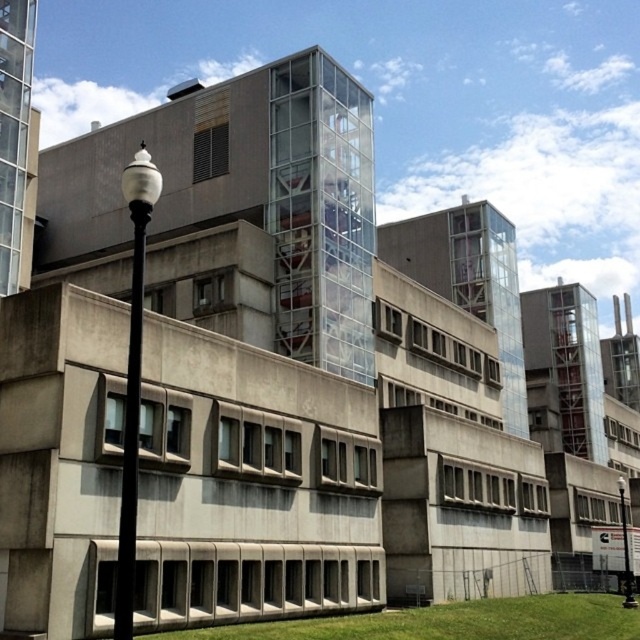
Question: Which point is farther to the camera?

Choices:
 (A) black metal/texture lamp post at left
 (B) black glass lamp post at lower right
 (C) green grass at lower center

Answer: (B)

Question: Which is nearer to the black glass lamp post at lower right?

Choices:
 (A) green grass at lower center
 (B) black metal/texture lamp post at left

Answer: (A)

Question: Observing the image, what is the correct spatial positioning of green grass at lower center in reference to black glass lamp post at lower right?

Choices:
 (A) left
 (B) right

Answer: (A)

Question: Estimate the real-world distances between objects in this image. Which object is farther from the green grass at lower center?

Choices:
 (A) black glass lamp post at lower right
 (B) black metal/texture lamp post at left

Answer: (B)

Question: Is green grass at lower center wider than black metal/texture lamp post at left?

Choices:
 (A) yes
 (B) no

Answer: (A)

Question: Does green grass at lower center have a larger size compared to black metal/texture lamp post at left?

Choices:
 (A) no
 (B) yes

Answer: (A)